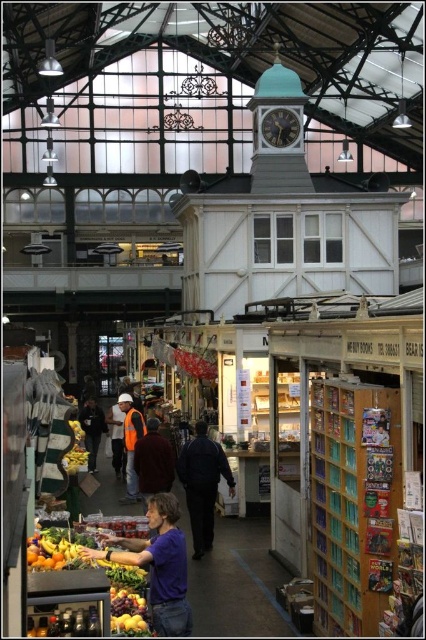
You are a customer in the market and want to place the shiny yellow bananas at lower left on a shelf that can only accommodate items wider than the purple cotton shirt at center. Is this possible?

The purple cotton shirt at center is wider than the shiny yellow bananas at lower left. Since the shelf requires items wider than the purple cotton shirt at center, the shiny yellow bananas at lower left cannot fit as they are narrower.

You are a vendor at the market and need to place both the shiny yellow bananas at center and the orange reflective vest at center on a shelf that can only hold items narrower than 30 cm. Which item should you place first to ensure both fit?

The shiny yellow bananas at center has a width less than the orange reflective vest at center. Since the shelf requires items narrower than 30 cm, you should place the wider orange reflective vest at center first to ensure both items fit within the shelf width limit.

You are a visitor in the market and need to locate the reflective orange vest at center. According to the coordinates provided, where exactly is it positioned in the image?

The reflective orange vest at center is located at point coordinates of 0.692 on the x axis and 0.308 on the y axis.